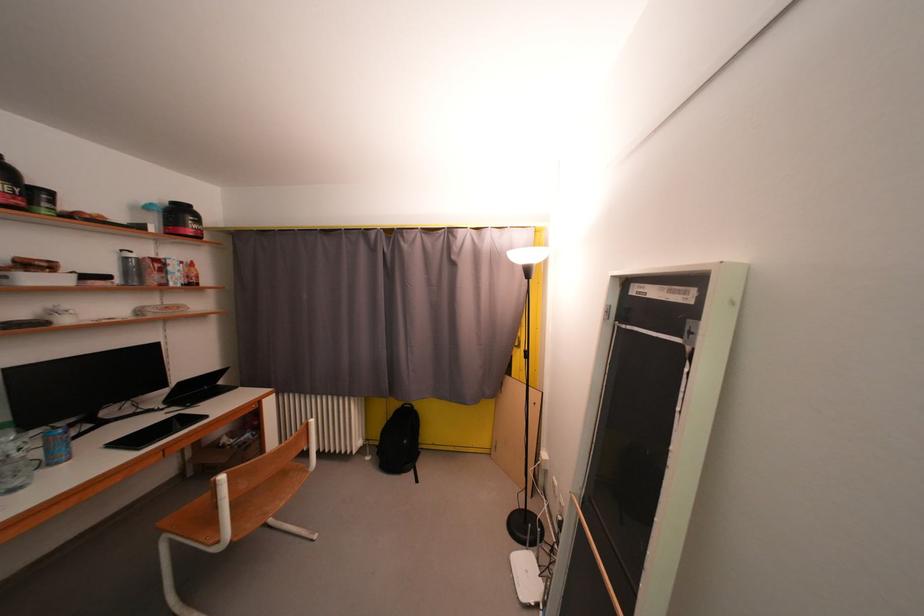
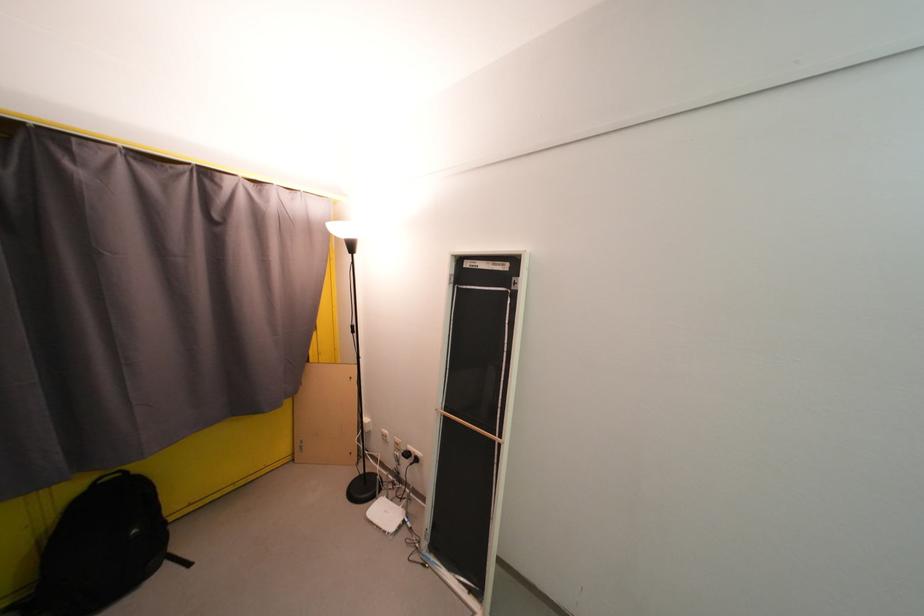
Find the pixel in the second image that matches (x=533, y=573) in the first image.

(392, 515)